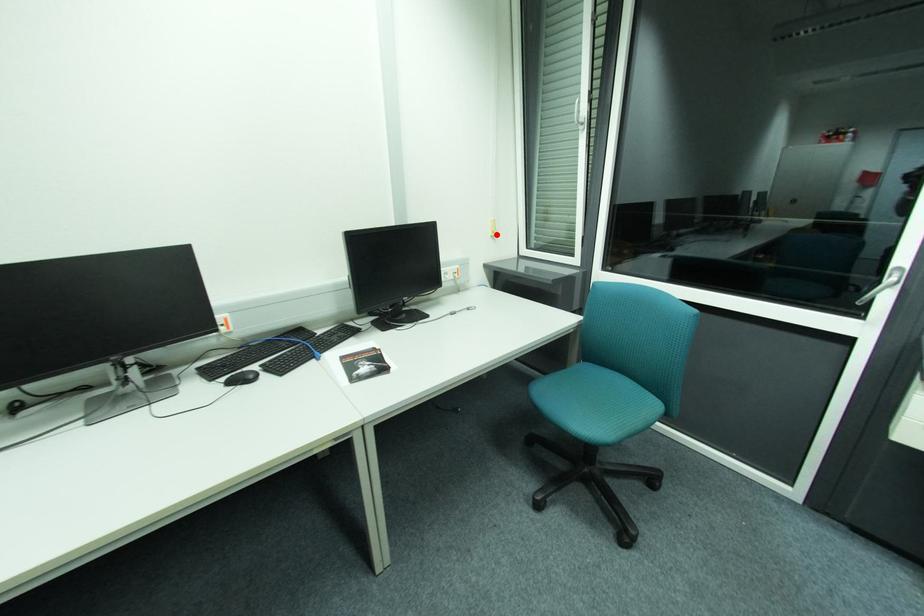
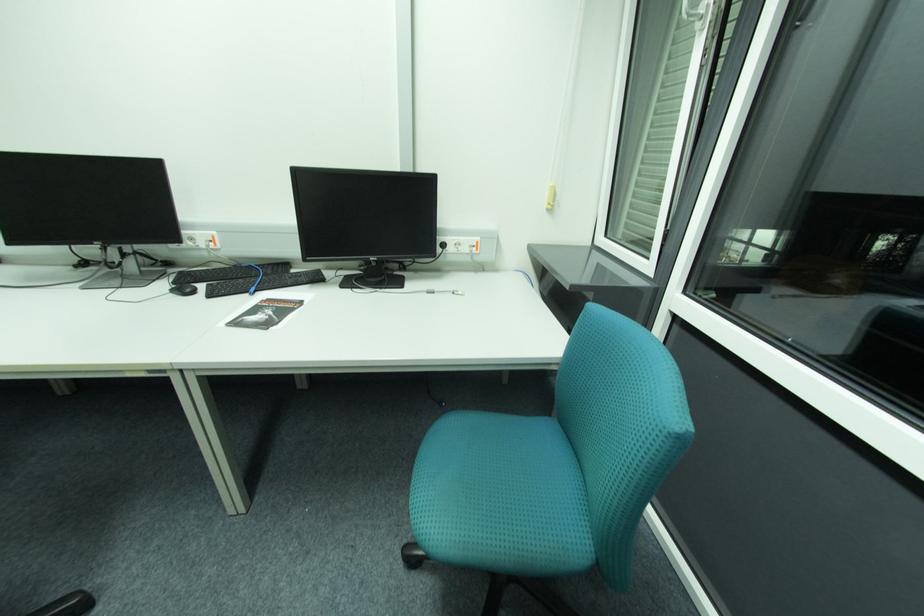
Locate, in the second image, the point that corresponds to the highlighted location in the first image.

(552, 206)